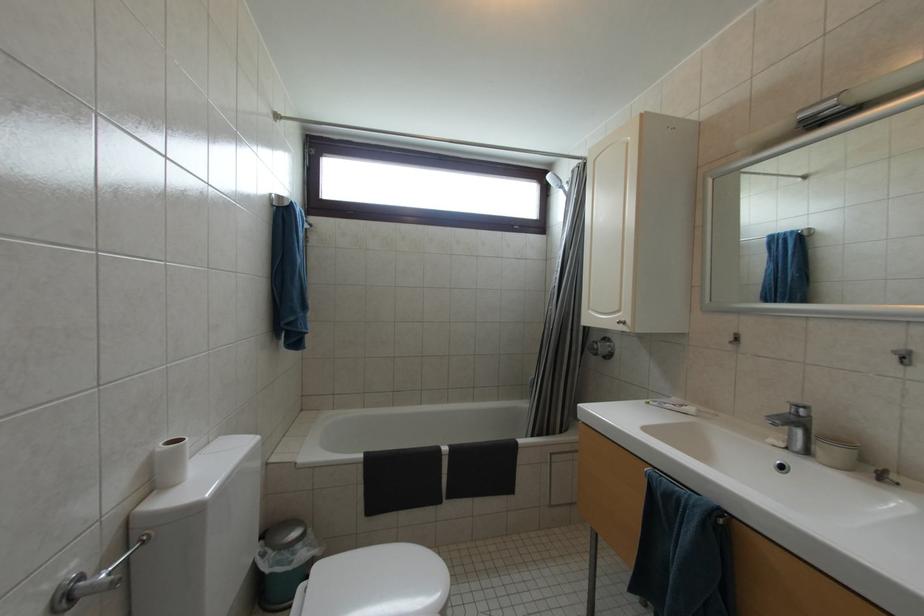
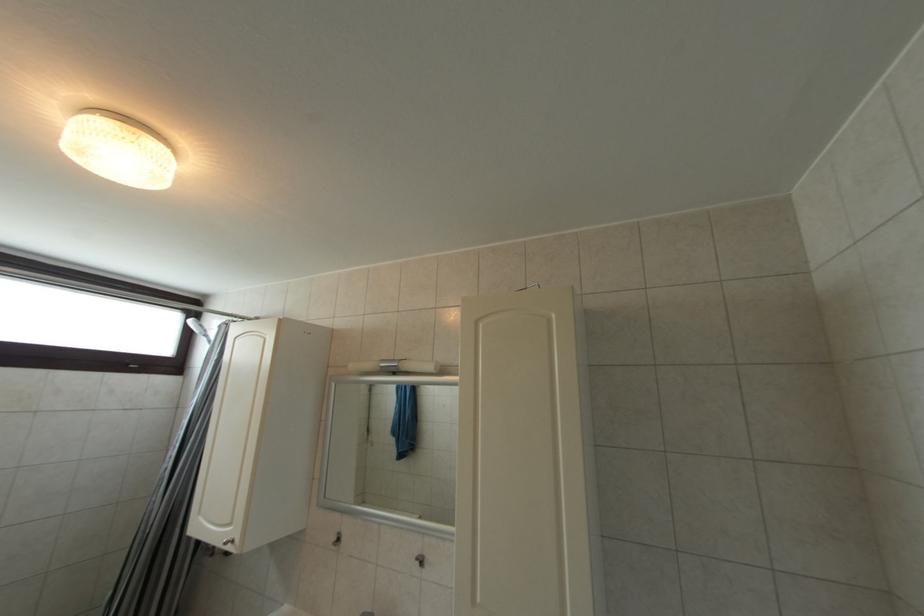
Question: The camera is either moving clockwise (left) or counter-clockwise (right) around the object. The first image is from the beginning of the video and the second image is from the end. Is the camera moving left or right when shooting the video?

Choices:
 (A) Left
 (B) Right

Answer: (A)